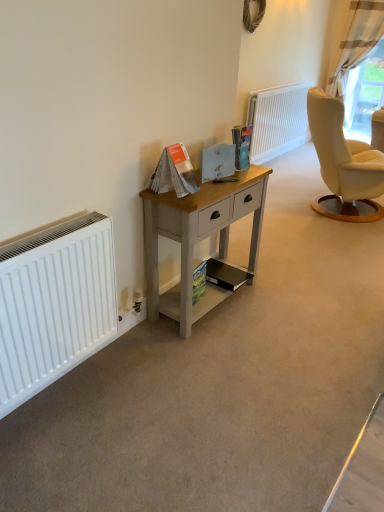
Identify the location of free area below white matte radiator at lower left, which is the first radiator from bottom to top (from a real-world perspective). The width and height of the screenshot is (384, 512). (64, 381).